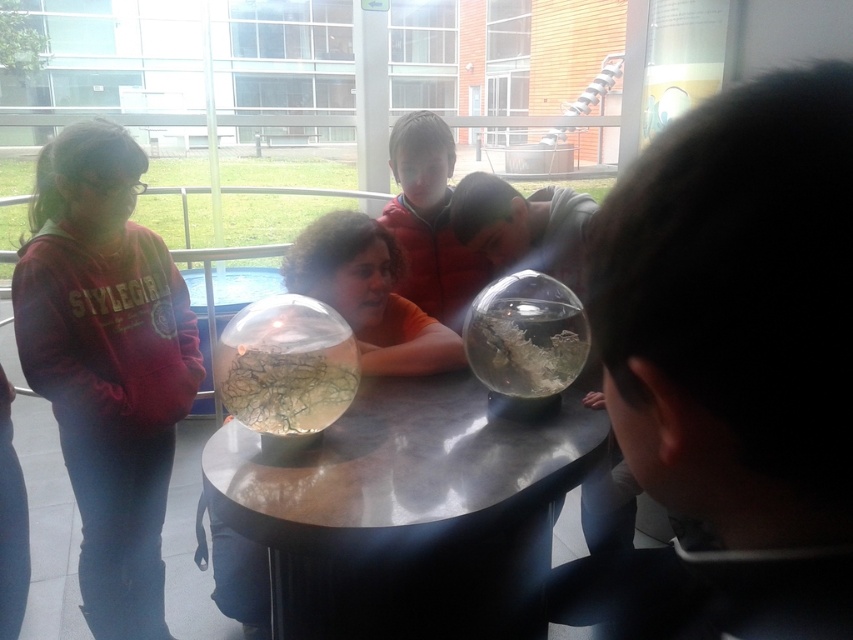
You are a guest at this gathering and want to place a small gift on the table without blocking the view of the translucent glass bowl at center. Where should you place the gift on the metallic reflective table at center?

The metallic reflective table at center is in front of the translucent glass bowl at center, so placing the gift on the metallic reflective table at center behind the bowl would ensure it doesn

You are part of the group around the table and want to hand a small note to the person in the orange shirt. To do this, you need to pass the note around the table. Since the transparent glass sphere at center and the translucent glass bowl at center are in the way, which object should you move to make space?

The translucent glass bowl at center is behind the transparent glass sphere at center, so you should move the translucent glass bowl at center to create space.

You are standing in front of the table and want to place a small object on the metallic reflective table at center. Where exactly should you aim to place it?

You should aim for point (407, 512) on the metallic reflective table at center as that is its exact location.